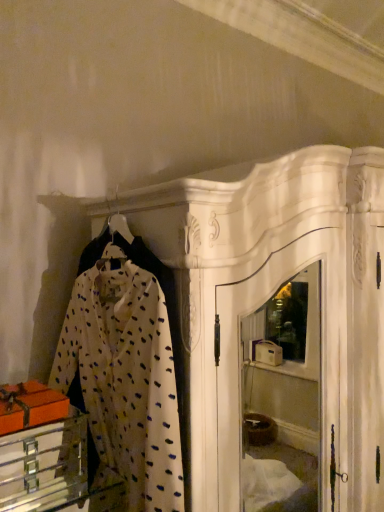
Question: Is white dotted fabric at center oriented towards metallic silver drawer at lower left?

Choices:
 (A) yes
 (B) no

Answer: (A)

Question: Is white dotted fabric at center closer to the viewer compared to metallic silver drawer at lower left?

Choices:
 (A) yes
 (B) no

Answer: (A)

Question: From the image's perspective, does white dotted fabric at center appear higher than metallic silver drawer at lower left?

Choices:
 (A) yes
 (B) no

Answer: (A)

Question: Is white dotted fabric at center facing away from metallic silver drawer at lower left?

Choices:
 (A) no
 (B) yes

Answer: (B)

Question: From a real-world perspective, is white dotted fabric at center located higher than metallic silver drawer at lower left?

Choices:
 (A) no
 (B) yes

Answer: (B)

Question: Is white dotted fabric at center touching metallic silver drawer at lower left?

Choices:
 (A) no
 (B) yes

Answer: (A)

Question: From the image's perspective, is metallic silver drawer at lower left located above white dotted fabric at center?

Choices:
 (A) no
 (B) yes

Answer: (A)

Question: From a real-world perspective, is metallic silver drawer at lower left beneath white dotted fabric at center?

Choices:
 (A) yes
 (B) no

Answer: (A)

Question: Is metallic silver drawer at lower left touching white dotted fabric at center?

Choices:
 (A) yes
 (B) no

Answer: (B)

Question: Could you tell me if metallic silver drawer at lower left is turned towards white dotted fabric at center?

Choices:
 (A) no
 (B) yes

Answer: (A)

Question: Is metallic silver drawer at lower left far from white dotted fabric at center?

Choices:
 (A) yes
 (B) no

Answer: (B)

Question: Is white dotted fabric at center completely or partially inside metallic silver drawer at lower left?

Choices:
 (A) no
 (B) yes

Answer: (A)

Question: Would you say metallic silver drawer at lower left is inside or outside white dotted fabric at center?

Choices:
 (A) outside
 (B) inside

Answer: (B)